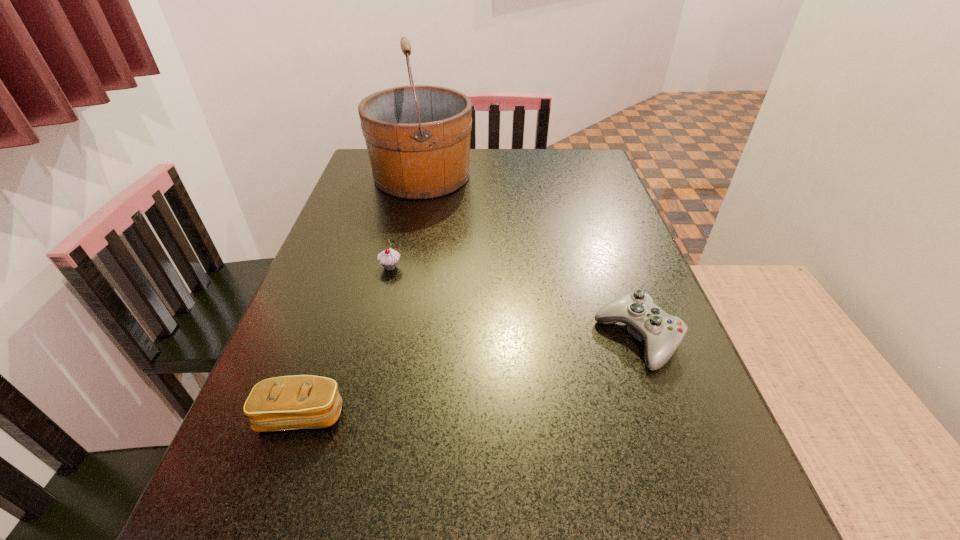
This screenshot has width=960, height=540. I want to click on vacant point located between the second nearest object and the nearest object, so click(x=469, y=377).

I want to click on blank region between the bucket and the control, so click(x=530, y=257).

The width and height of the screenshot is (960, 540). I want to click on free point between the tallest object and the cupcake, so click(406, 221).

Where is `vacant region between the tallest object and the nearest object`? vacant region between the tallest object and the nearest object is located at coordinates (362, 295).

You are a GUI agent. You are given a task and a screenshot of the screen. Output one action in this format:
    pyautogui.click(x=<x>, y=<y>)
    Task: Click on the free space between the tallest object and the second farthest object
    The height and width of the screenshot is (540, 960).
    Given the screenshot: What is the action you would take?
    pyautogui.click(x=406, y=221)

What are the coordinates of `vacant space in between the farthest object and the nearest object` in the screenshot? It's located at [362, 295].

This screenshot has height=540, width=960. Identify the location of free spot between the third nearest object and the clutch bag. (346, 341).

You are a GUI agent. You are given a task and a screenshot of the screen. Output one action in this format:
    pyautogui.click(x=<x>, y=<y>)
    Task: Click on the blank region between the bucket and the cupcake
    
    Given the screenshot: What is the action you would take?
    pyautogui.click(x=406, y=221)

Image resolution: width=960 pixels, height=540 pixels. Identify the location of unoccupied position between the nearest object and the rightmost object. (469, 377).

Locate an element on the screen. vacant space that is in between the farthest object and the cupcake is located at coordinates (406, 221).